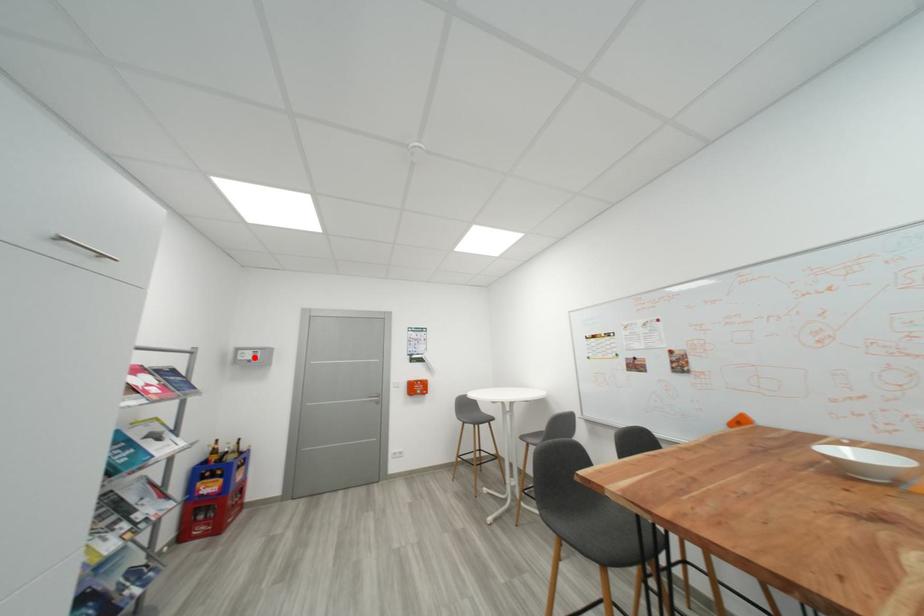
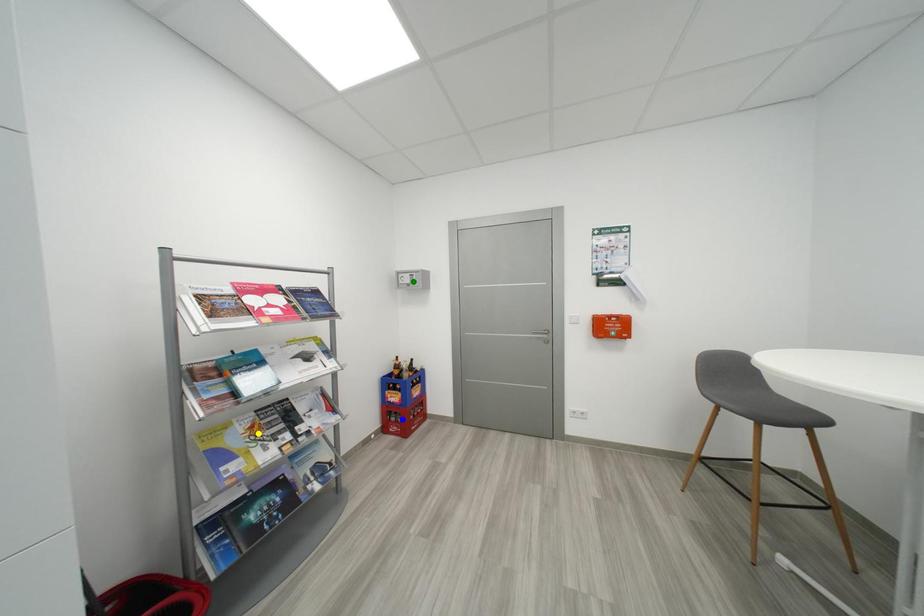
Question: I am providing you with two images of the same scene from different viewpoints. A red point is marked on the first image. You are given multiple points on the second image. Can you choose the point in image 2 that corresponds to the point in image 1?

Choices:
 (A) blue point
 (B) green point
 (C) yellow point

Answer: (B)